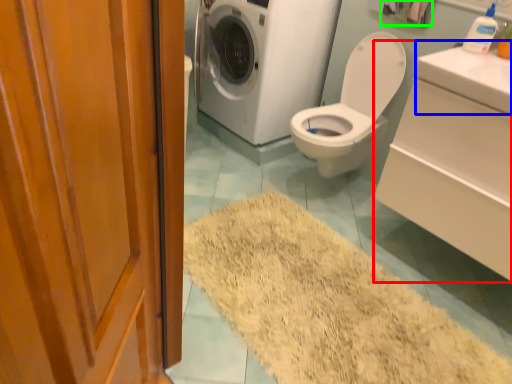
Question: Based on their relative distances, which object is nearer to counter top (highlighted by a red box)? Choose from counter top (highlighted by a blue box) and toilet paper (highlighted by a green box).

Choices:
 (A) counter top
 (B) toilet paper

Answer: (A)